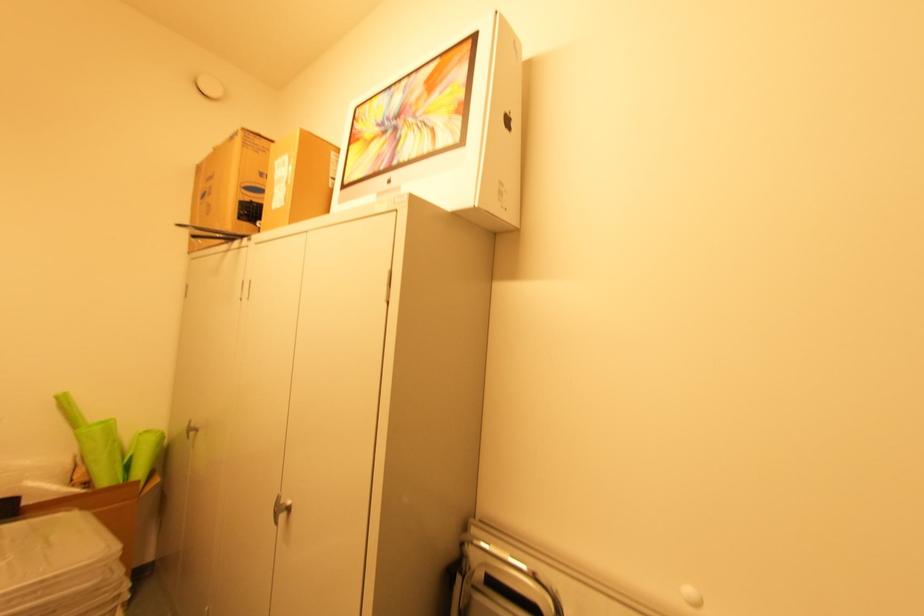
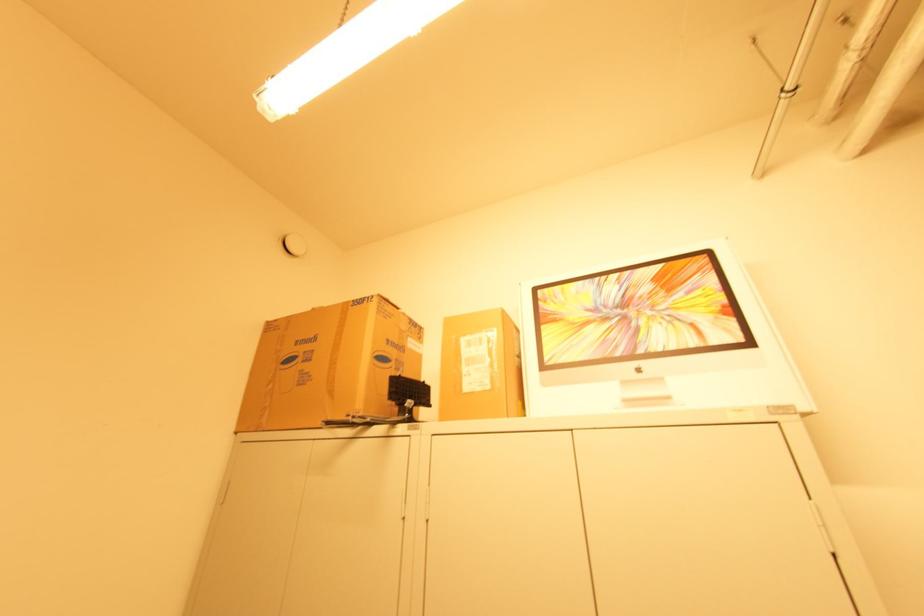
Locate, in the second image, the point that corresponds to point 334,180 in the first image.

(520, 359)